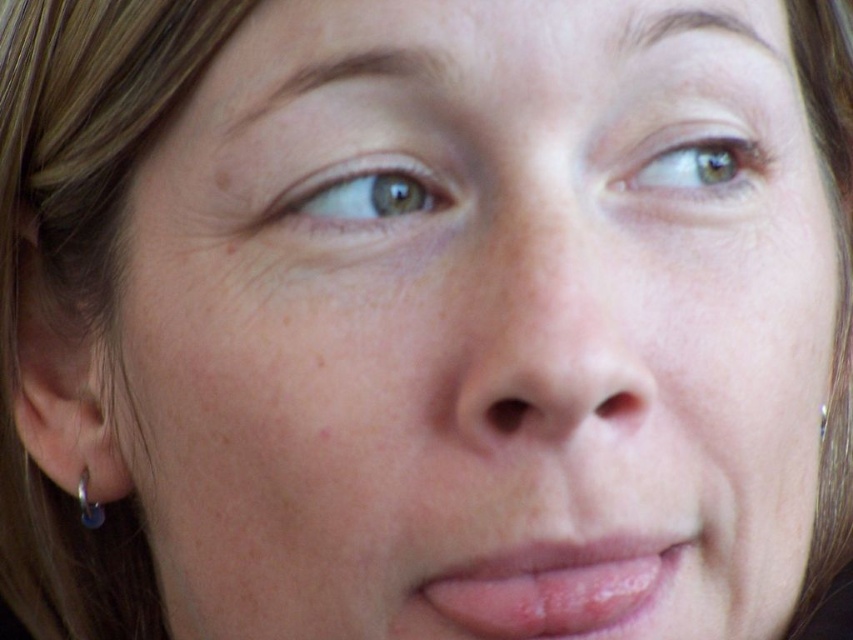
Which is more to the left, green matte eye at upper right or brown matte eye at upper left?

brown matte eye at upper left

The image size is (853, 640). What do you see at coordinates (691, 163) in the screenshot?
I see `green matte eye at upper right` at bounding box center [691, 163].

I want to click on green matte eye at upper right, so click(x=691, y=163).

Is point (432, 180) positioned after point (827, 412)?

No, it is not.

Consider the image. Does brown matte eye at upper left appear under silver metallic hoop at left ear?

No.

Which is behind, point (410, 180) or point (824, 428)?

The point (824, 428) is more distant.

You are a GUI agent. You are given a task and a screenshot of the screen. Output one action in this format:
    pyautogui.click(x=<x>, y=<y>)
    Task: Click on the brown matte eye at upper left
    Image resolution: width=853 pixels, height=640 pixels.
    Given the screenshot: What is the action you would take?
    pyautogui.click(x=366, y=192)

Which of these two, green matte eye at upper right or silver metallic earring at lower left, stands taller?

silver metallic earring at lower left

Is green matte eye at upper right above silver metallic earring at lower left?

Yes, green matte eye at upper right is above silver metallic earring at lower left.

Is point (653, 196) closer to camera compared to point (80, 472)?

Yes, point (653, 196) is closer to viewer.

Identify the location of green matte eye at upper right. pyautogui.click(x=691, y=163).